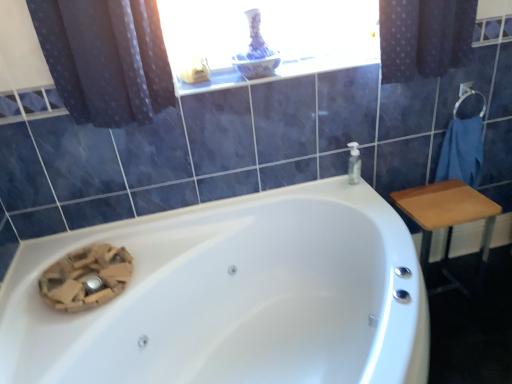
Question: Is white glossy bathtub at center wider than blue cotton towel at right?

Choices:
 (A) yes
 (B) no

Answer: (A)

Question: From a real-world perspective, is white glossy bathtub at center physically above blue cotton towel at right?

Choices:
 (A) no
 (B) yes

Answer: (A)

Question: Does white glossy bathtub at center touch blue cotton towel at right?

Choices:
 (A) yes
 (B) no

Answer: (B)

Question: Could you tell me if white glossy bathtub at center is facing blue cotton towel at right?

Choices:
 (A) yes
 (B) no

Answer: (B)

Question: From the image's perspective, is white glossy bathtub at center above blue cotton towel at right?

Choices:
 (A) no
 (B) yes

Answer: (A)

Question: From a real-world perspective, is white glossy bathtub at center below blue cotton towel at right?

Choices:
 (A) no
 (B) yes

Answer: (B)

Question: Is white glossy bathtub at center taller than transparent plastic soap dispenser at upper right?

Choices:
 (A) no
 (B) yes

Answer: (B)

Question: Is white glossy bathtub at center oriented away from transparent plastic soap dispenser at upper right?

Choices:
 (A) no
 (B) yes

Answer: (A)

Question: Could you tell me if white glossy bathtub at center is facing transparent plastic soap dispenser at upper right?

Choices:
 (A) yes
 (B) no

Answer: (B)

Question: Does white glossy bathtub at center have a larger size compared to transparent plastic soap dispenser at upper right?

Choices:
 (A) no
 (B) yes

Answer: (B)

Question: From the image's perspective, would you say white glossy bathtub at center is positioned over transparent plastic soap dispenser at upper right?

Choices:
 (A) no
 (B) yes

Answer: (A)

Question: Are white glossy bathtub at center and transparent plastic soap dispenser at upper right beside each other?

Choices:
 (A) no
 (B) yes

Answer: (A)

Question: Considering the relative positions of white glossy window sill at upper center and transparent plastic soap dispenser at upper right in the image provided, is white glossy window sill at upper center to the left of transparent plastic soap dispenser at upper right from the viewer's perspective?

Choices:
 (A) yes
 (B) no

Answer: (A)